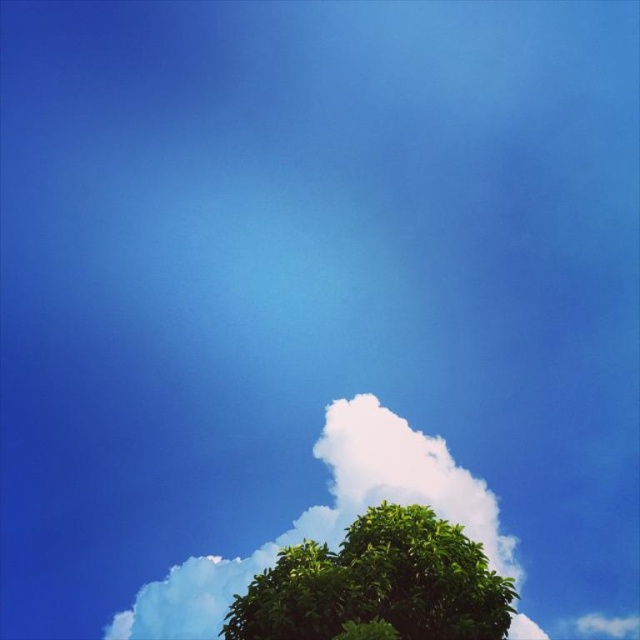
From the picture: Is green leafy tree at lower center further to the viewer compared to white fluffy cloud at lower center?

No, green leafy tree at lower center is closer to the viewer.

Between green leafy tree at lower center and white fluffy cloud at lower center, which one has more height?

With more height is green leafy tree at lower center.

The height and width of the screenshot is (640, 640). What are the coordinates of `green leafy tree at lower center` in the screenshot? It's located at (378, 584).